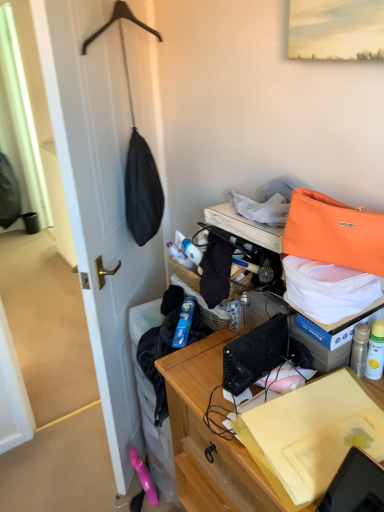
You are a GUI agent. You are given a task and a screenshot of the screen. Output one action in this format:
    pyautogui.click(x=<x>, y=<y>)
    Task: Click on the free point above orange leather handbag at upper right (from a real-world perspective)
    
    Given the screenshot: What is the action you would take?
    pyautogui.click(x=327, y=265)